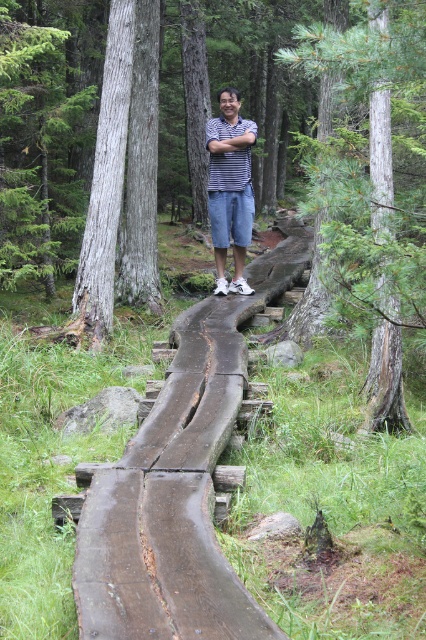
You are a photographer trying to capture the striped fabric shirt at center and the striped cotton shirt at center in a single shot. Since both shirts are at the same position, which one will appear larger in the photo?

The striped fabric shirt at center will appear larger in the photo because it is closer to the viewer than the striped cotton shirt at center.

You are a hiker who wants to take a photo of the green textured tree trunk at center and the striped cotton shirt at center. Which object should you focus on first if you want to ensure both are in the frame without moving the camera?

The striped cotton shirt at center is taller than the green textured tree trunk at center, so focusing on the taller striped cotton shirt at center first would help ensure both are in the frame without needing to adjust the camera angle.